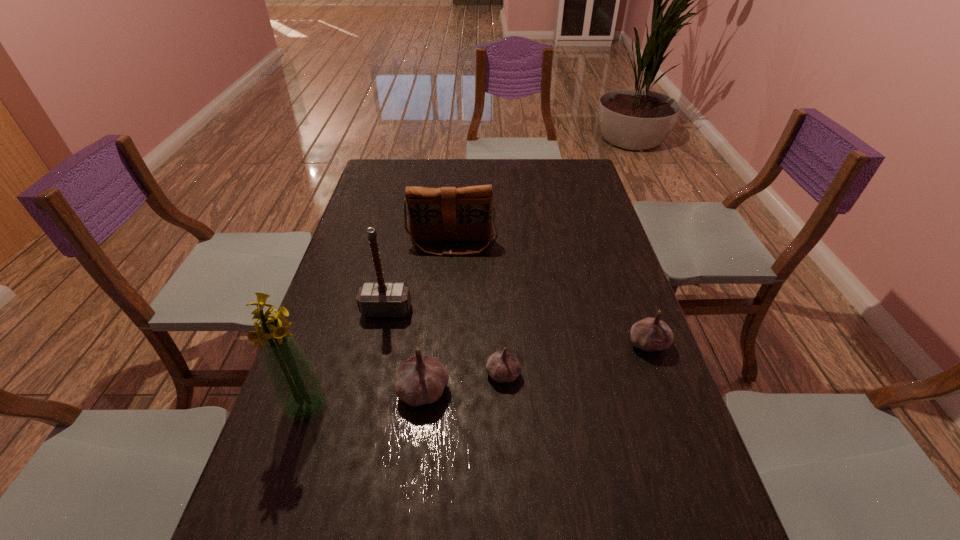
Locate an element on the screen. The width and height of the screenshot is (960, 540). the tallest garlic is located at coordinates (420, 380).

This screenshot has height=540, width=960. In order to click on the third shortest object in this screenshot , I will do `click(420, 380)`.

You are a GUI agent. You are given a task and a screenshot of the screen. Output one action in this format:
    pyautogui.click(x=<x>, y=<y>)
    Task: Click on the shortest object
    The width and height of the screenshot is (960, 540).
    Given the screenshot: What is the action you would take?
    pyautogui.click(x=502, y=366)

You are a GUI agent. You are given a task and a screenshot of the screen. Output one action in this format:
    pyautogui.click(x=<x>, y=<y>)
    Task: Click on the second garlic from left to right
    This screenshot has width=960, height=540.
    Given the screenshot: What is the action you would take?
    pyautogui.click(x=502, y=366)

Identify the location of the second shortest object. This screenshot has width=960, height=540. (650, 334).

Where is `the rightmost garlic`? Image resolution: width=960 pixels, height=540 pixels. the rightmost garlic is located at coordinates (650, 334).

I want to click on the third tallest object, so click(x=448, y=213).

Image resolution: width=960 pixels, height=540 pixels. I want to click on the farthest object, so click(448, 213).

You are a GUI agent. You are given a task and a screenshot of the screen. Output one action in this format:
    pyautogui.click(x=<x>, y=<y>)
    Task: Click on the fifth nearest object
    
    Given the screenshot: What is the action you would take?
    pyautogui.click(x=375, y=299)

Where is `hammer`? hammer is located at coordinates (375, 299).